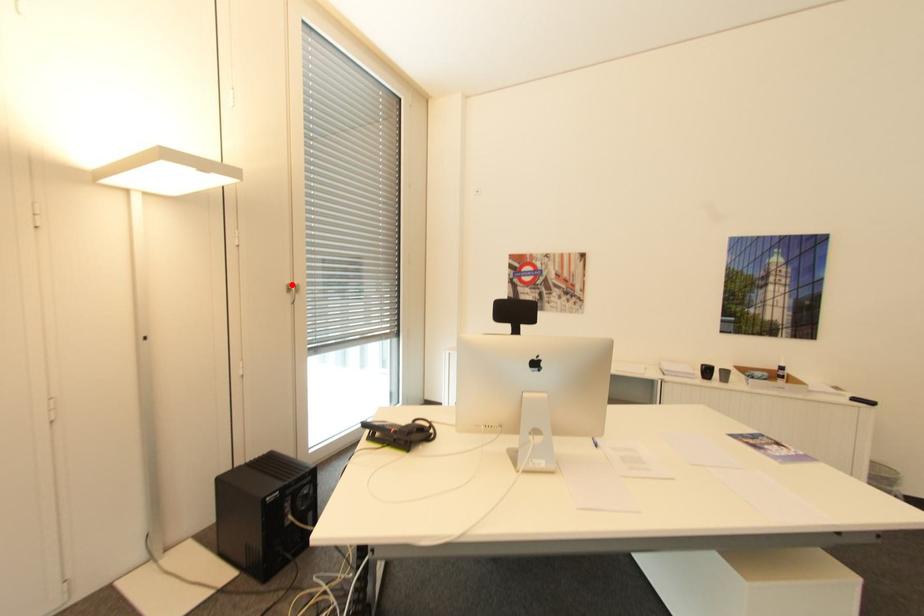
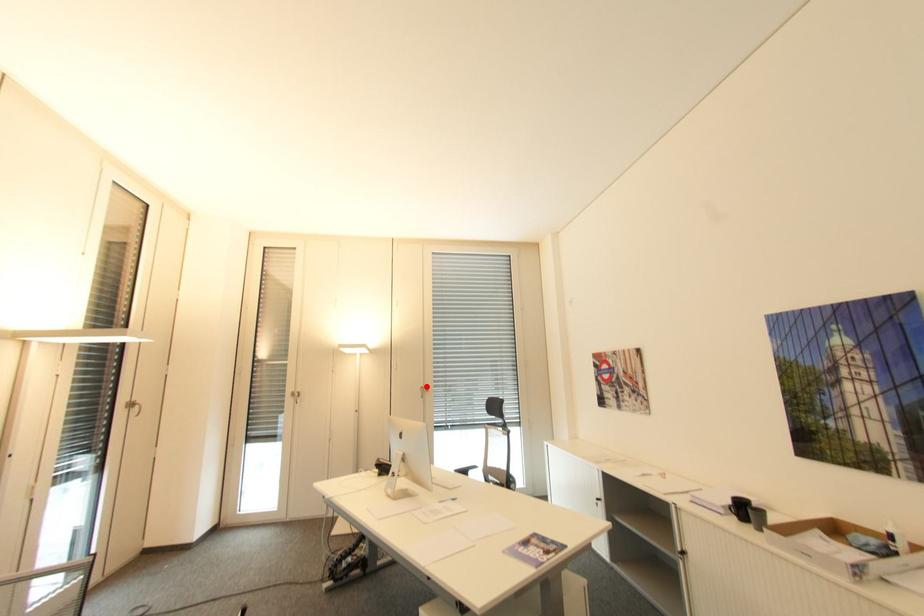
I am providing you with two images of the same scene from different viewpoints. A red point is marked on the first image and another point is marked on the second image. Is the marked point in image1 the same physical position as the marked point in image2?

Yes